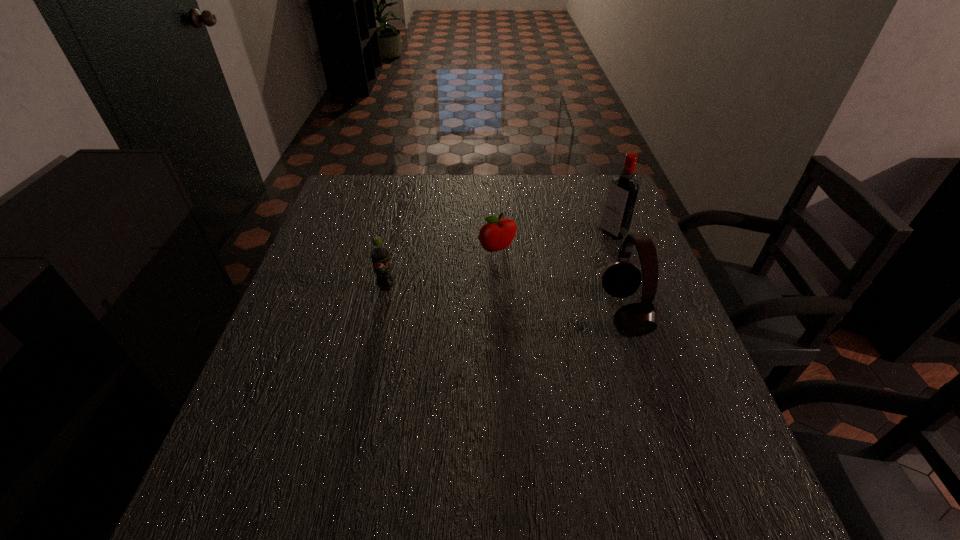
What are the coordinates of `vacant spot on the desktop that is between the second shortest object and the headset and is positioned on the front and back of the farthest object` in the screenshot? It's located at (496, 300).

The image size is (960, 540). Identify the location of free space on the desktop that is between the third tallest object and the third shortest object and is positioned on the front-facing side of the shortest object. (526, 302).